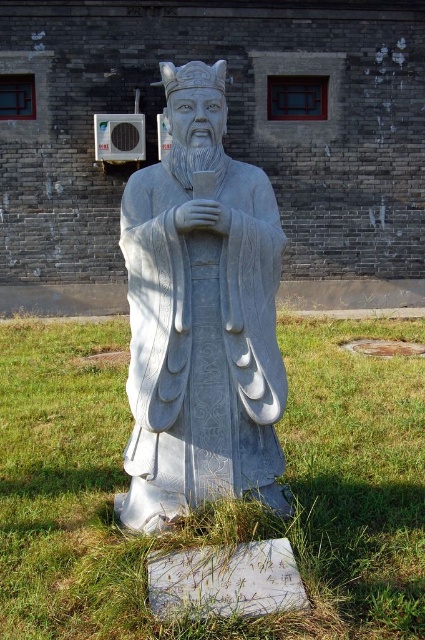
Question: Does green grass at center have a larger size compared to white stone statue at center?

Choices:
 (A) no
 (B) yes

Answer: (A)

Question: Which object appears closest to the camera in this image?

Choices:
 (A) white stone statue at center
 (B) green grass at center

Answer: (A)

Question: Does green grass at center appear over white stone statue at center?

Choices:
 (A) no
 (B) yes

Answer: (A)

Question: Among these objects, which one is nearest to the camera?

Choices:
 (A) white stone statue at center
 (B) green grass at center

Answer: (A)

Question: Can you confirm if green grass at center is bigger than white stone statue at center?

Choices:
 (A) no
 (B) yes

Answer: (A)